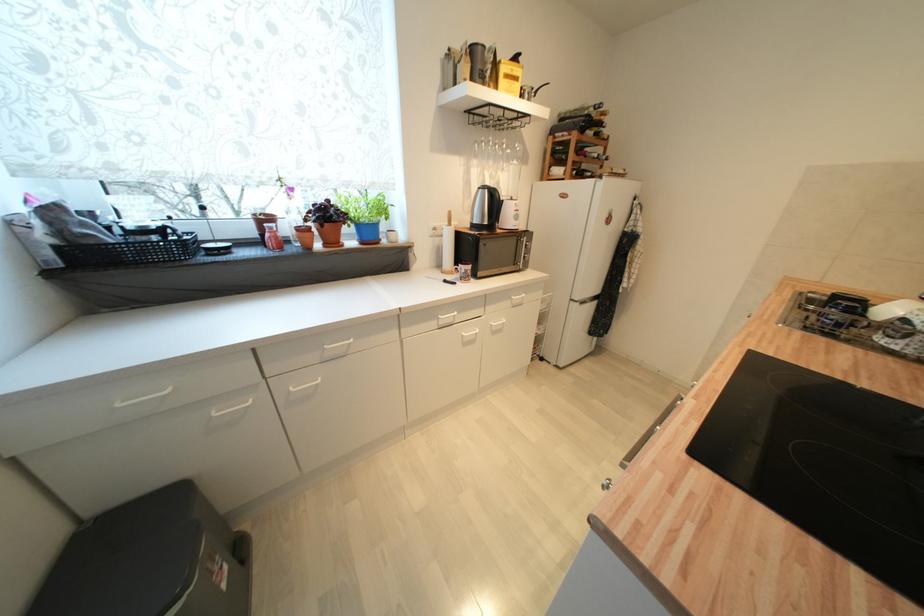
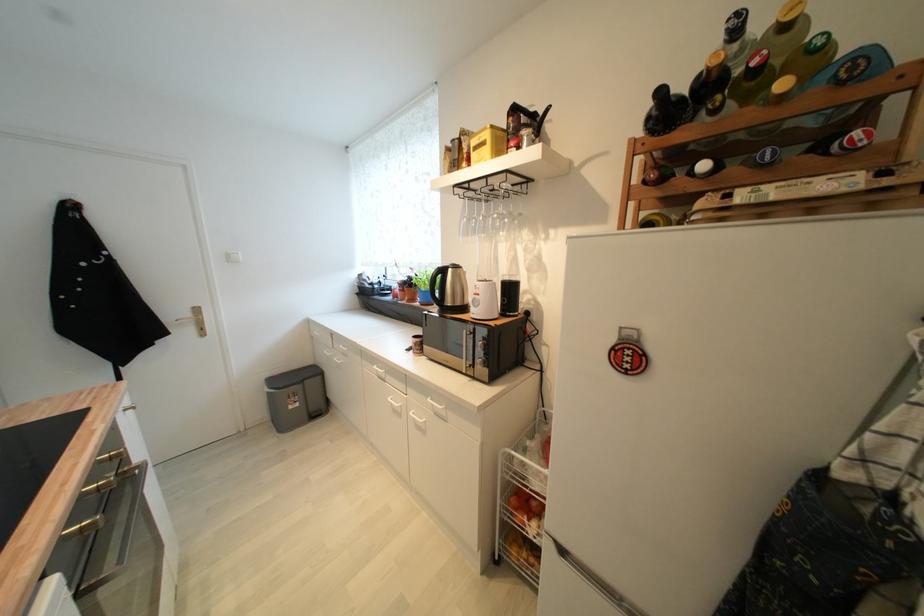
Find the pixel in the second image that matches pixel 228 588 in the first image.

(296, 408)